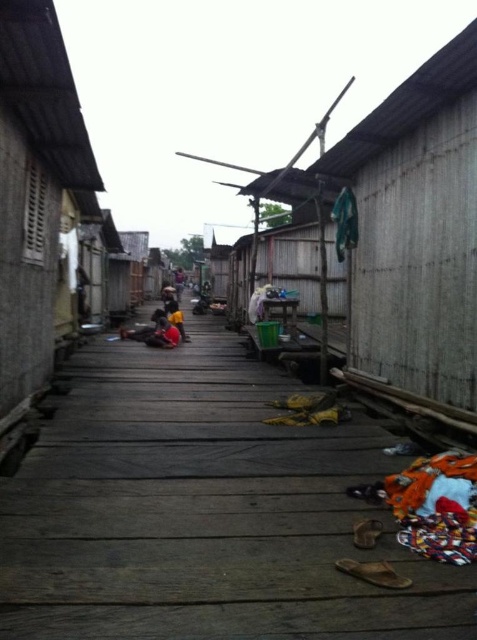
Question: From the image, what is the correct spatial relationship of dark brown leather jacket at center in relation to dark brown fabric at center?

Choices:
 (A) right
 (B) left

Answer: (B)

Question: Does dark brown leather jacket at center have a lesser width compared to dark brown fabric at center?

Choices:
 (A) yes
 (B) no

Answer: (B)

Question: Based on their relative distances, which object is farther from the wooden hut at right?

Choices:
 (A) dark brown leather jacket at center
 (B) dark blue fabric at center
 (C) dark brown fabric at center
 (D) wooden planks at center

Answer: (B)

Question: Is wooden planks at center wider than wooden hut at right?

Choices:
 (A) yes
 (B) no

Answer: (A)

Question: Which is farther from the dark brown leather jacket at center?

Choices:
 (A) wooden planks at center
 (B) dark blue fabric at center
 (C) dark brown fabric at center

Answer: (B)

Question: Which object is the farthest from the wooden hut at right?

Choices:
 (A) dark blue fabric at center
 (B) dark brown fabric at center

Answer: (A)